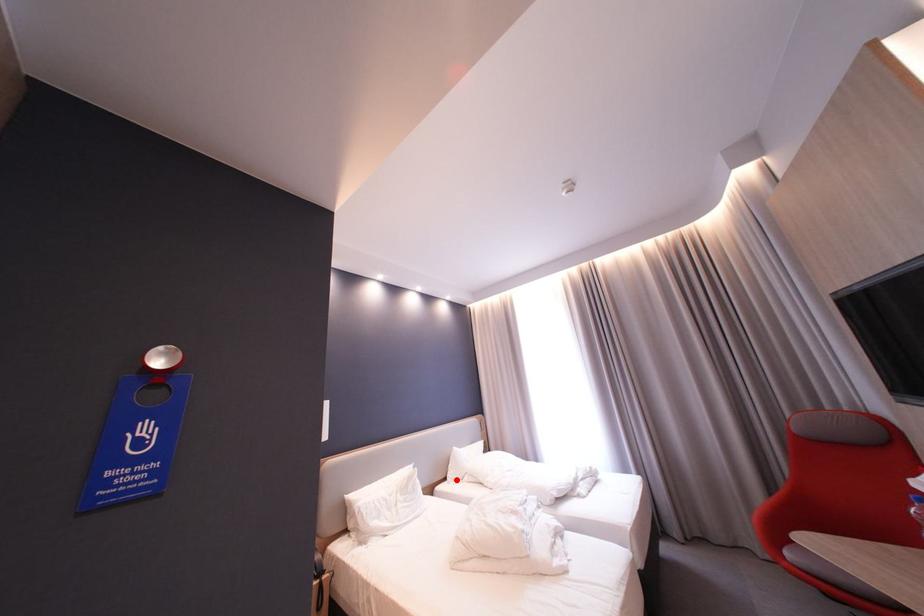
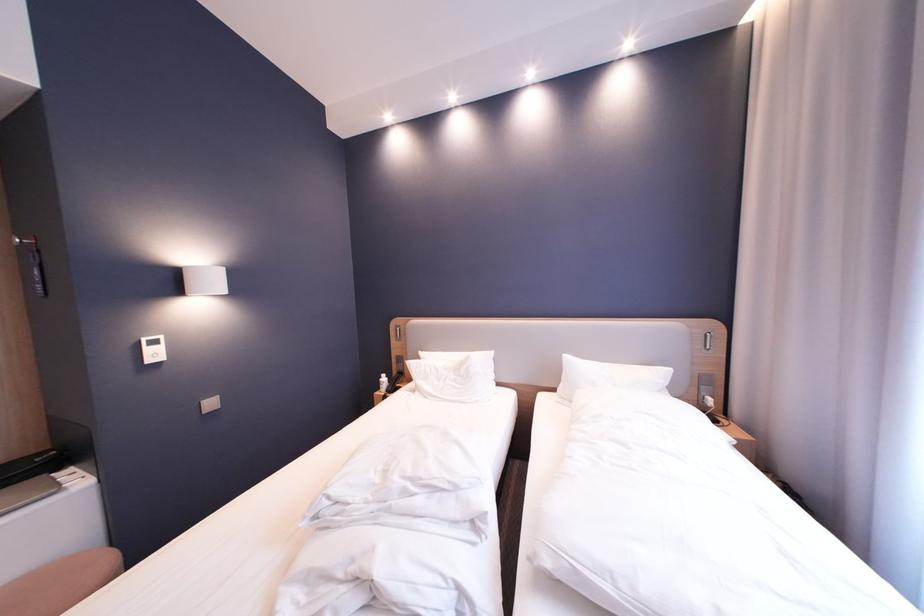
Question: I am providing you with two images of the same scene from different viewpoints. A red point is shown in image1. For the corresponding object point in image2, is it positioned nearer or farther from the camera?

Choices:
 (A) Nearer
 (B) Farther

Answer: (A)